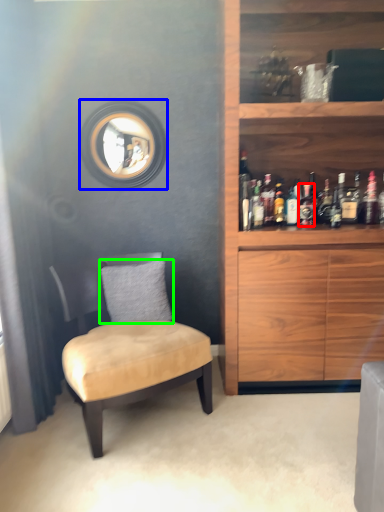
Question: Estimate the real-world distances between objects in this image. Which object is closer to bottle (highlighted by a red box), mirror (highlighted by a blue box) or pillow (highlighted by a green box)?

Choices:
 (A) mirror
 (B) pillow

Answer: (B)